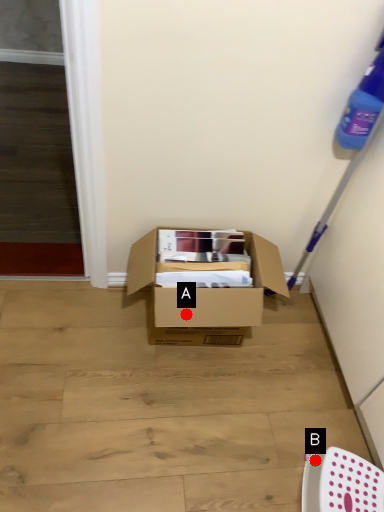
Question: Two points are circled on the image, labeled by A and B beside each circle. Which of the following is the closest to the observer?

Choices:
 (A) A is closer
 (B) B is closer

Answer: (B)